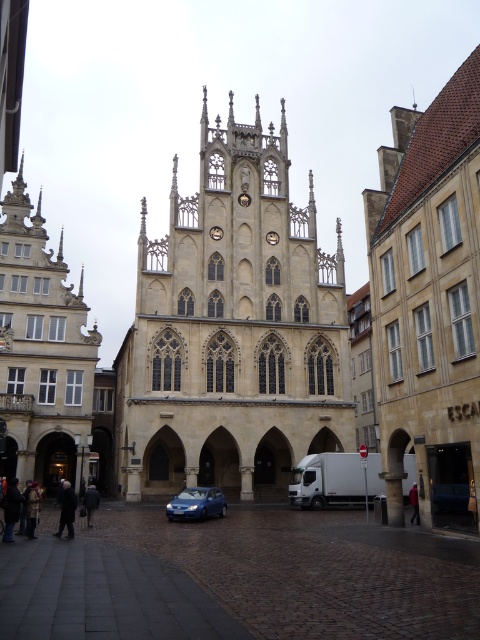
Question: Where is brown stone church at center located in relation to beige stone church at left in the image?

Choices:
 (A) right
 (B) left

Answer: (A)

Question: Which object is closer to the camera taking this photo?

Choices:
 (A) beige stone tower at center
 (B) dark gray fabric coat at lower left
 (C) blue metallic car at center
 (D) dark gray coat at lower left

Answer: (B)

Question: Which point is farther from the camera taking this photo?

Choices:
 (A) (418, 500)
 (B) (86, 520)

Answer: (B)

Question: Is the position of beige stone tower at center more distant than that of dark gray fabric coat at lower left?

Choices:
 (A) no
 (B) yes

Answer: (B)

Question: Is brown stone church at center thinner than dark gray fabric coat at lower left?

Choices:
 (A) yes
 (B) no

Answer: (B)

Question: Which is nearer to the dark brown leather jacket at lower left?

Choices:
 (A) dark brown leather coat at lower left
 (B) dark gray fabric coat at lower left

Answer: (A)